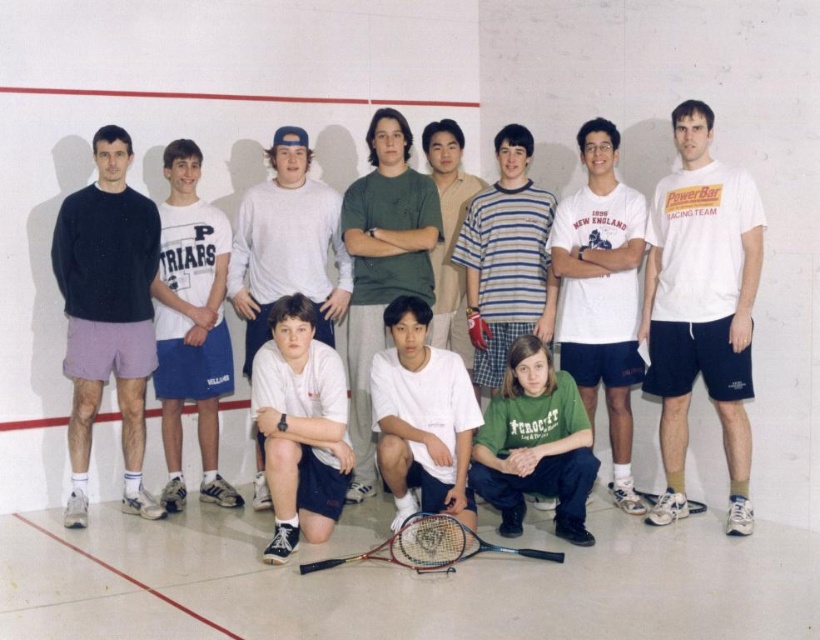
Between green cotton shirt at center and white matte tennis racket at center, which one has more height?

green cotton shirt at center

Locate an element on the screen. The width and height of the screenshot is (820, 640). green cotton shirt at center is located at coordinates (381, 264).

The image size is (820, 640). What do you see at coordinates (600, 292) in the screenshot?
I see `white cotton t-shirt at center` at bounding box center [600, 292].

Locate an element on the screen. Image resolution: width=820 pixels, height=640 pixels. white cotton t-shirt at center is located at coordinates (600, 292).

Is point (369, 145) farther from camera compared to point (533, 240)?

Yes, it is behind point (533, 240).

At what (x,y) coordinates should I click in order to perform the action: click on green cotton shirt at center. Please return your answer as a coordinate pair (x, y). Looking at the image, I should click on (381, 264).